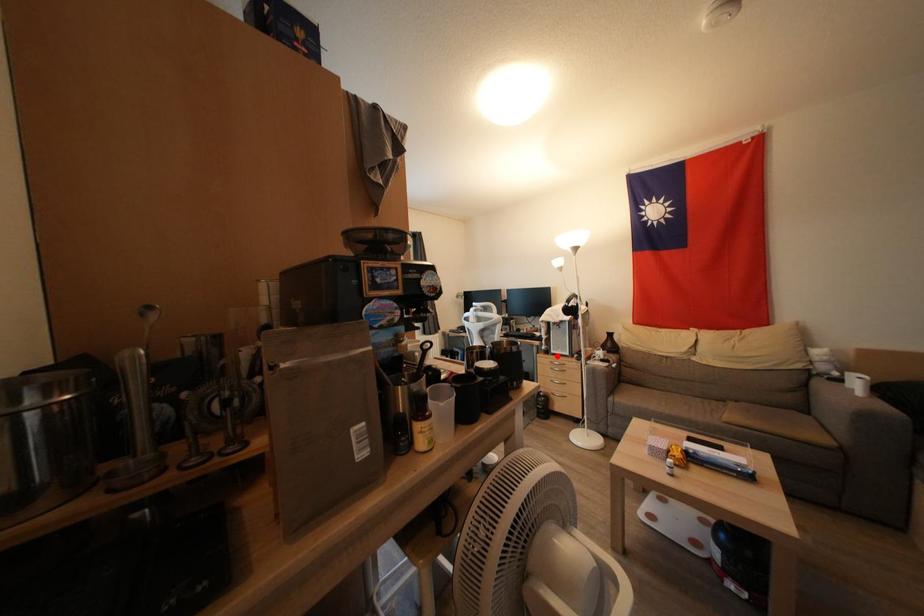
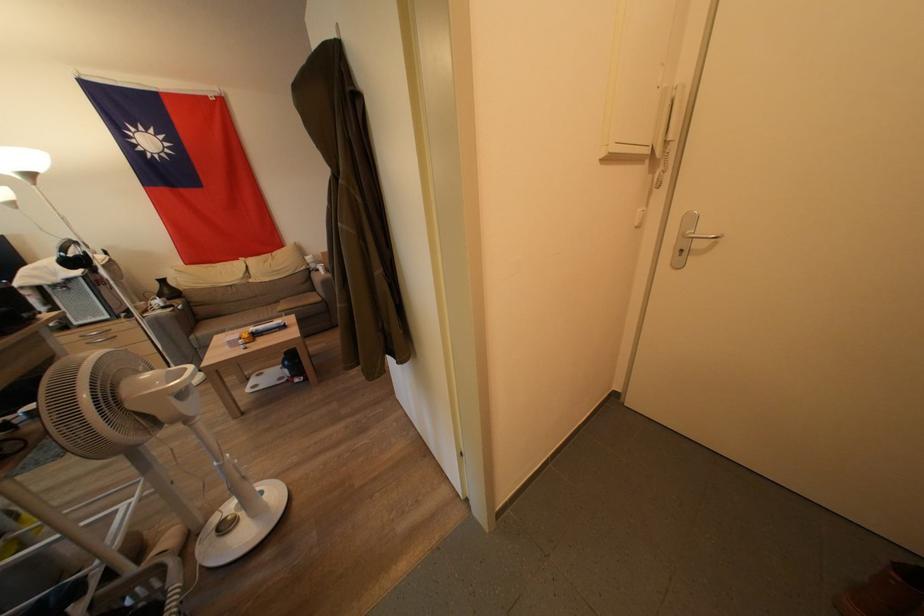
Question: I am providing you with two images of the same scene from different viewpoints. Image1 has a red point marked. In image2, the corresponding 3D location appears at what relative position? Reply with the corresponding letter.

Choices:
 (A) Closer
 (B) Farther

Answer: (B)